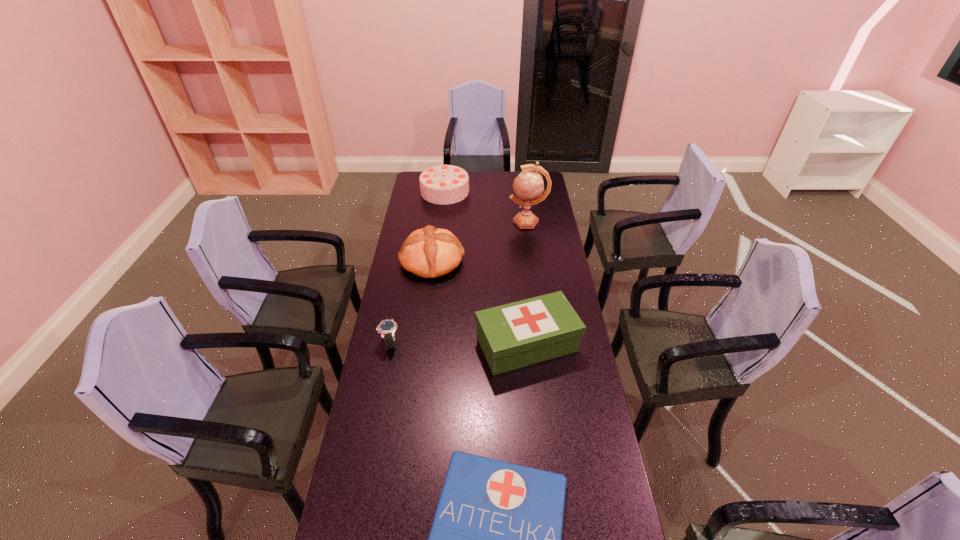
The width and height of the screenshot is (960, 540). Identify the location of the fifth nearest object. (528, 185).

The width and height of the screenshot is (960, 540). I want to click on globe, so click(x=528, y=185).

The height and width of the screenshot is (540, 960). What are the coordinates of `birthday cake` in the screenshot? It's located at (444, 184).

Identify the location of the fifth shortest object. (444, 184).

You are a GUI agent. You are given a task and a screenshot of the screen. Output one action in this format:
    pyautogui.click(x=<x>, y=<y>)
    Task: Click on the fourth nearest object
    The height and width of the screenshot is (540, 960).
    Given the screenshot: What is the action you would take?
    pyautogui.click(x=430, y=252)

I want to click on the farther first-aid kit, so click(515, 335).

In order to click on the fifth tallest object in this screenshot , I will do `click(387, 328)`.

Locate an element on the screen. vacant region located 0.340m on the front-facing side of the second farthest object is located at coordinates (443, 221).

You are a GUI agent. You are given a task and a screenshot of the screen. Output one action in this format:
    pyautogui.click(x=<x>, y=<y>)
    Task: Click on the free space located 0.220m on the front-facing side of the second farthest object
    The height and width of the screenshot is (540, 960).
    Given the screenshot: What is the action you would take?
    pyautogui.click(x=466, y=221)

This screenshot has height=540, width=960. In order to click on vacant space situated 0.310m on the front-facing side of the second farthest object in this screenshot , I will do `click(448, 221)`.